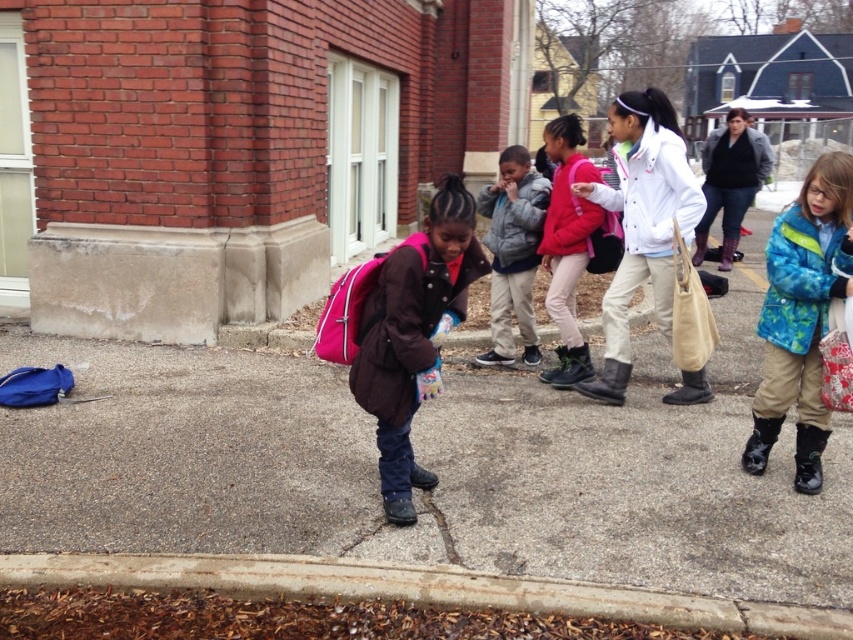
Question: Based on their relative distances, which object is nearer to the white matte jacket at center?

Choices:
 (A) concrete at lower left
 (B) blue fleece jacket at right
 (C) gray asphalt at center

Answer: (B)

Question: Which of the following is the farthest from the observer?

Choices:
 (A) (531, 321)
 (B) (666, 330)
 (C) (415, 548)

Answer: (A)

Question: Is the position of gray asphalt at center less distant than that of gray fleece jacket at center?

Choices:
 (A) no
 (B) yes

Answer: (B)

Question: Which object is the closest to the white matte jacket at center?

Choices:
 (A) gray asphalt at center
 (B) pink fabric backpack at center
 (C) concrete at lower left
 (D) blue fleece jacket at right

Answer: (D)

Question: Does gray asphalt at center have a smaller size compared to gray fleece jacket at center?

Choices:
 (A) yes
 (B) no

Answer: (A)

Question: Is pink fabric backpack at center wider than blue fleece jacket at right?

Choices:
 (A) no
 (B) yes

Answer: (A)